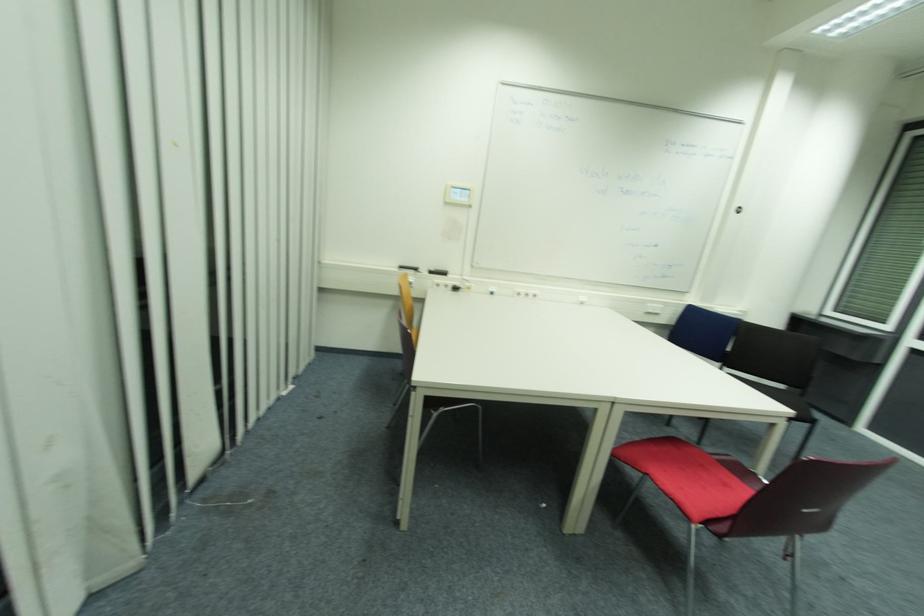
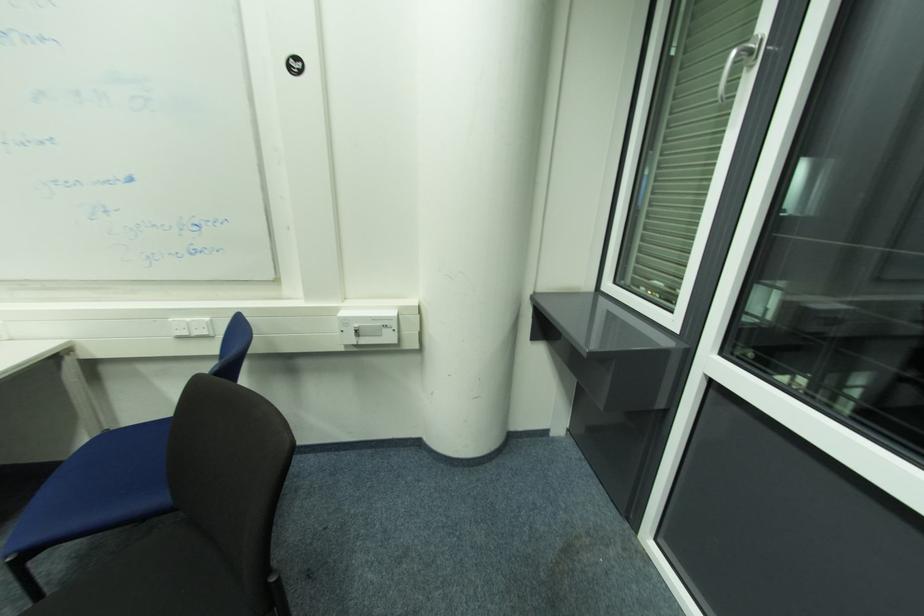
What movement of the cameraman would produce the second image?

The cameraman moved toward right, forward.